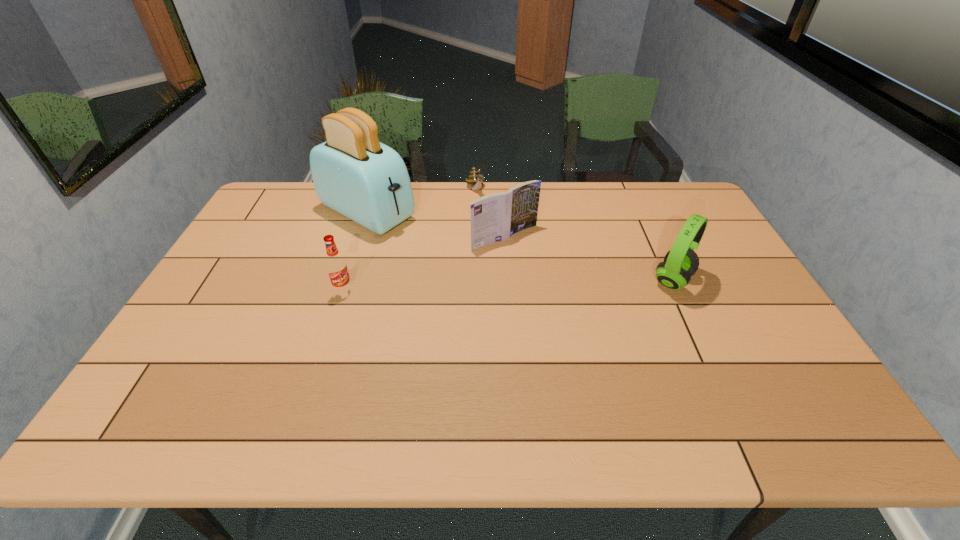
Identify the location of vacant space on the desktop that is between the root beer and the rightmost object and is positioned on the face of the snail. Image resolution: width=960 pixels, height=540 pixels. (527, 285).

This screenshot has height=540, width=960. I want to click on vacant space on the desktop that is between the root beer and the headset and is positioned on the side of the tallest object with the lever, so click(x=505, y=285).

Locate an element on the screen. The height and width of the screenshot is (540, 960). free spot on the desktop that is between the root beer and the headset and is positioned on the front cover of the book is located at coordinates (554, 284).